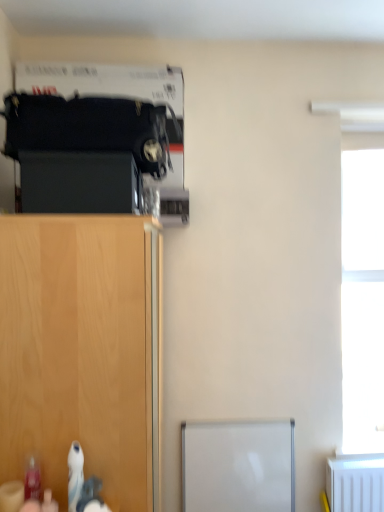
Question: Based on their sizes in the image, would you say black matte cabinet at left is bigger or smaller than transparent glass window at right?

Choices:
 (A) small
 (B) big

Answer: (A)

Question: Looking at their shapes, would you say black matte cabinet at left is wider or thinner than transparent glass window at right?

Choices:
 (A) wide
 (B) thin

Answer: (A)

Question: Which is nearer to the black matte cabinet at left?

Choices:
 (A) wooden cabinet at lower left
 (B) transparent glass window at right

Answer: (A)

Question: Which object is the closest to the transparent glass window at right?

Choices:
 (A) wooden cabinet at lower left
 (B) black matte cabinet at left

Answer: (A)